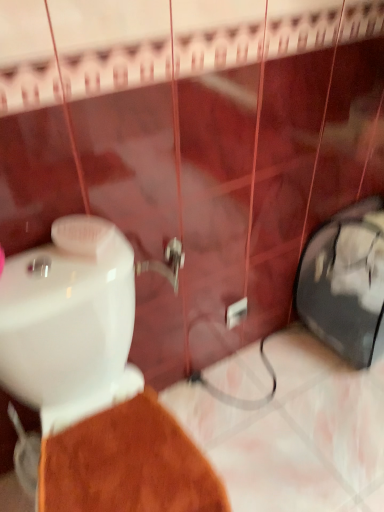
What do you see at coordinates (93, 380) in the screenshot?
I see `white glossy toilet at lower left` at bounding box center [93, 380].

Measure the distance between point (41, 338) and camera.

A distance of 33.19 inches exists between point (41, 338) and camera.

Locate an element on the screen. This screenshot has height=512, width=384. white glossy toilet at lower left is located at coordinates (93, 380).

The width and height of the screenshot is (384, 512). Describe the element at coordinates (236, 313) in the screenshot. I see `white plastic electric outlet at center` at that location.

Measure the distance between white plastic electric outlet at center and camera.

A distance of 1.43 meters exists between white plastic electric outlet at center and camera.

Identify the location of white plastic electric outlet at center. The image size is (384, 512). (236, 313).

Image resolution: width=384 pixels, height=512 pixels. What are the coordinates of `white glossy toilet at lower left` in the screenshot? It's located at (93, 380).

In the image, is white plastic electric outlet at center on the left side or the right side of white glossy toilet at lower left?

From the image, it's evident that white plastic electric outlet at center is to the right of white glossy toilet at lower left.

Relative to white glossy toilet at lower left, is white plastic electric outlet at center in front or behind?

white plastic electric outlet at center is positioned farther from the viewer than white glossy toilet at lower left.

Is point (232, 325) closer or farther from the camera than point (194, 478)?

Clearly, point (232, 325) is more distant from the camera than point (194, 478).

From the image's perspective, would you say white plastic electric outlet at center is positioned over white glossy toilet at lower left?

Yes, from the image's perspective, white plastic electric outlet at center is on top of white glossy toilet at lower left.

From a real-world perspective, is white plastic electric outlet at center located beneath white glossy toilet at lower left?

Indeed, from a real-world perspective, white plastic electric outlet at center is positioned beneath white glossy toilet at lower left.

Which object is wider, white plastic electric outlet at center or white glossy toilet at lower left?

Wider between the two is white glossy toilet at lower left.

Between white plastic electric outlet at center and white glossy toilet at lower left, which one has more height?

white glossy toilet at lower left is taller.

Based on the photo, considering the relative sizes of white plastic electric outlet at center and white glossy toilet at lower left in the image provided, is white plastic electric outlet at center smaller than white glossy toilet at lower left?

Yes, white plastic electric outlet at center is smaller than white glossy toilet at lower left.

Would you say white plastic electric outlet at center is inside or outside white glossy toilet at lower left?

white plastic electric outlet at center is not enclosed by white glossy toilet at lower left.

Is white plastic electric outlet at center far from white glossy toilet at lower left?

white plastic electric outlet at center is near white glossy toilet at lower left, not far away.

Looking at this image, is white plastic electric outlet at center facing towards white glossy toilet at lower left?

No, white plastic electric outlet at center is not oriented towards white glossy toilet at lower left.

How many degrees apart are the facing directions of white plastic electric outlet at center and white glossy toilet at lower left?

3.23 degrees separate the facing orientations of white plastic electric outlet at center and white glossy toilet at lower left.

How much distance is there between white plastic electric outlet at center and white glossy toilet at lower left?

24.85 inches.

Locate an element on the screen. electric outlet located behind the white glossy toilet at lower left is located at coordinates (236, 313).

Considering the relative positions of white glossy toilet at lower left and white plastic electric outlet at center in the image provided, is white glossy toilet at lower left to the left of white plastic electric outlet at center from the viewer's perspective?

Yes, white glossy toilet at lower left is to the left of white plastic electric outlet at center.

Is white glossy toilet at lower left behind white plastic electric outlet at center?

No.

Which is behind, point (45, 474) or point (230, 314)?

The point (230, 314) is farther.

From the image's perspective, does white glossy toilet at lower left appear higher than white plastic electric outlet at center?

No, from the image's perspective, white glossy toilet at lower left is not over white plastic electric outlet at center.

Based on the photo, from a real-world perspective, is white glossy toilet at lower left below white plastic electric outlet at center?

No.

In terms of width, does white glossy toilet at lower left look wider or thinner when compared to white plastic electric outlet at center?

Considering their sizes, white glossy toilet at lower left looks broader than white plastic electric outlet at center.

Who is shorter, white glossy toilet at lower left or white plastic electric outlet at center?

Standing shorter between the two is white plastic electric outlet at center.

Who is bigger, white glossy toilet at lower left or white plastic electric outlet at center?

white glossy toilet at lower left is bigger.

Could white plastic electric outlet at center be considered to be inside white glossy toilet at lower left?

No, white glossy toilet at lower left does not contain white plastic electric outlet at center.

Is white glossy toilet at lower left far from white plastic electric outlet at center?

Actually, white glossy toilet at lower left and white plastic electric outlet at center are a little close together.

Is white glossy toilet at lower left oriented away from white plastic electric outlet at center?

No.

How different are the orientations of white glossy toilet at lower left and white plastic electric outlet at center in degrees?

There is a 3.23-degree angle between the facing directions of white glossy toilet at lower left and white plastic electric outlet at center.

How far apart are white glossy toilet at lower left and white plastic electric outlet at center?

white glossy toilet at lower left and white plastic electric outlet at center are 24.85 inches apart from each other.

I want to click on electric outlet above the white glossy toilet at lower left (from the image's perspective), so click(236, 313).

This screenshot has height=512, width=384. In the image, there is a white glossy toilet at lower left. What are the coordinates of `electric outlet above it (from the image's perspective)` in the screenshot? It's located at [236, 313].

Where is `electric outlet that is under the white glossy toilet at lower left (from a real-world perspective)`? This screenshot has height=512, width=384. electric outlet that is under the white glossy toilet at lower left (from a real-world perspective) is located at coordinates (236, 313).